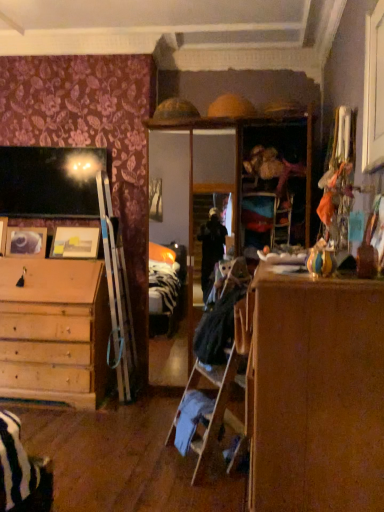
What do you see at coordinates (75, 242) in the screenshot? I see `matte wooden picture frame at left, the 2th picture frame when ordered from left to right` at bounding box center [75, 242].

Measure the distance between point (36,252) and camera.

The distance of point (36,252) from camera is 12.18 feet.

Locate an element on the screen. The image size is (384, 512). brown wood dresser at center is located at coordinates (317, 394).

Locate an element on the screen. The width and height of the screenshot is (384, 512). matte wooden picture frame at left, which appears as the 1th picture frame when viewed from the right is located at coordinates coord(75,242).

Choose the correct answer: Is matte wooden picture frame at left, the 2th picture frame when ordered from left to right, inside wooden photo frame at left, which appears as the 1th picture frame when viewed from the left, or outside it?

The correct answer is: outside.

Measure the distance from matte wooden picture frame at left, which appears as the 1th picture frame when viewed from the right, to wooden photo frame at left, marked as the second picture frame in a right-to-left arrangement.

They are 10.04 inches apart.

Between matte wooden picture frame at left, the 2th picture frame when ordered from left to right, and wooden photo frame at left, marked as the second picture frame in a right-to-left arrangement, which one appears on the left side from the viewer's perspective?

From the viewer's perspective, wooden photo frame at left, marked as the second picture frame in a right-to-left arrangement, appears more on the left side.

Is the depth of matte wooden picture frame at left, the 2th picture frame when ordered from left to right, less than that of wooden photo frame at left, marked as the second picture frame in a right-to-left arrangement?

Yes.

Does black fabric laundry at center turn towards wooden photo frame at left, marked as the second picture frame in a right-to-left arrangement?

No, black fabric laundry at center is not oriented towards wooden photo frame at left, marked as the second picture frame in a right-to-left arrangement.

From their relative heights in the image, would you say black fabric laundry at center is taller or shorter than wooden photo frame at left, which appears as the 1th picture frame when viewed from the left?

Clearly, black fabric laundry at center is taller compared to wooden photo frame at left, which appears as the 1th picture frame when viewed from the left.

From the picture: From the image's perspective, is black fabric laundry at center located above wooden photo frame at left, which appears as the 1th picture frame when viewed from the left?

Actually, black fabric laundry at center appears below wooden photo frame at left, which appears as the 1th picture frame when viewed from the left, in the image.

From a real-world perspective, which is physically above, black fabric laundry at center or wooden photo frame at left, which appears as the 1th picture frame when viewed from the left?

wooden photo frame at left, which appears as the 1th picture frame when viewed from the left, is physically above.

Considering the positions of objects brown wood dresser at center and matte wooden picture frame at left, the 2th picture frame when ordered from left to right, in the image provided, who is behind, brown wood dresser at center or matte wooden picture frame at left, the 2th picture frame when ordered from left to right,?

Positioned behind is matte wooden picture frame at left, the 2th picture frame when ordered from left to right.

Which of these two, brown wood dresser at center or matte wooden picture frame at left, the 2th picture frame when ordered from left to right, is smaller?

Smaller between the two is matte wooden picture frame at left, the 2th picture frame when ordered from left to right.

In the scene shown: From a real-world perspective, does brown wood dresser at center stand above matte wooden picture frame at left, which appears as the 1th picture frame when viewed from the right?

Actually, brown wood dresser at center is physically below matte wooden picture frame at left, which appears as the 1th picture frame when viewed from the right, in the real world.

From the image's perspective, which is above, brown wood dresser at center or matte wooden picture frame at left, the 2th picture frame when ordered from left to right?

matte wooden picture frame at left, the 2th picture frame when ordered from left to right, from the image's perspective.

From the image's perspective, which object appears higher, wooden photo frame at left, which appears as the 1th picture frame when viewed from the left, or brown wood dresser at center?

wooden photo frame at left, which appears as the 1th picture frame when viewed from the left, from the image's perspective.

Consider the image. Does wooden photo frame at left, marked as the second picture frame in a right-to-left arrangement, have a lesser height compared to brown wood dresser at center?

Correct, wooden photo frame at left, marked as the second picture frame in a right-to-left arrangement, is not as tall as brown wood dresser at center.

Does point (16, 233) appear closer or farther from the camera than point (348, 436)?

Point (16, 233) appears to be farther away from the viewer than point (348, 436).

Based on their sizes in the image, would you say brown wood dresser at center is bigger or smaller than wooden photo frame at left, which appears as the 1th picture frame when viewed from the left?

Clearly, brown wood dresser at center is larger in size than wooden photo frame at left, which appears as the 1th picture frame when viewed from the left.

From the image's perspective, who appears lower, brown wood dresser at center or wooden photo frame at left, marked as the second picture frame in a right-to-left arrangement?

brown wood dresser at center appears lower in the image.

Is brown wood dresser at center not within wooden photo frame at left, marked as the second picture frame in a right-to-left arrangement?

Absolutely, brown wood dresser at center is external to wooden photo frame at left, marked as the second picture frame in a right-to-left arrangement.

Is the position of matte wooden picture frame at left, which appears as the 1th picture frame when viewed from the right, more distant than that of brown wood dresser at center?

Yes, it is.

Is matte wooden picture frame at left, which appears as the 1th picture frame when viewed from the right, shorter than brown wood dresser at center?

Correct, matte wooden picture frame at left, which appears as the 1th picture frame when viewed from the right, is not as tall as brown wood dresser at center.

From the image's perspective, is matte wooden picture frame at left, which appears as the 1th picture frame when viewed from the right, located above or below brown wood dresser at center?

matte wooden picture frame at left, which appears as the 1th picture frame when viewed from the right, is situated higher than brown wood dresser at center in the image.

Is black fabric laundry at center in front of brown wood dresser at center?

No.

Measure the distance between black fabric laundry at center and brown wood dresser at center.

The distance of black fabric laundry at center from brown wood dresser at center is 4.25 feet.

Can we say black fabric laundry at center lies outside brown wood dresser at center?

Yes.

You are a GUI agent. You are given a task and a screenshot of the screen. Output one action in this format:
    pyautogui.click(x=<x>, y=<y>)
    Task: Click on the cabinetry that appears below the black fabric laundry at center (from a real-world perspective)
    The image size is (384, 512).
    Given the screenshot: What is the action you would take?
    pyautogui.click(x=317, y=394)

Identify the location of picture frame behind the matte wooden picture frame at left, which appears as the 1th picture frame when viewed from the right. This screenshot has width=384, height=512. (26, 242).

Where is `the 1st picture frame positioned above the black fabric laundry at center (from a real-world perspective)`? The image size is (384, 512). the 1st picture frame positioned above the black fabric laundry at center (from a real-world perspective) is located at coordinates (26, 242).

Estimate the real-world distances between objects in this image. Which object is closer to matte wooden picture frame at left, the 2th picture frame when ordered from left to right, wooden photo frame at left, which appears as the 1th picture frame when viewed from the left, or brown wood dresser at center?

wooden photo frame at left, which appears as the 1th picture frame when viewed from the left, lies closer to matte wooden picture frame at left, the 2th picture frame when ordered from left to right, than the other object.

Considering their positions, is wooden photo frame at left, which appears as the 1th picture frame when viewed from the left, positioned further to brown wood dresser at center than matte wooden picture frame at left, which appears as the 1th picture frame when viewed from the right?

wooden photo frame at left, which appears as the 1th picture frame when viewed from the left.

Estimate the real-world distances between objects in this image. Which object is further from wooden photo frame at left, which appears as the 1th picture frame when viewed from the left, brown wood dresser at center or matte wooden picture frame at left, which appears as the 1th picture frame when viewed from the right?

brown wood dresser at center is further to wooden photo frame at left, which appears as the 1th picture frame when viewed from the left.

Based on the photo, from the image, which object appears to be farther from matte wooden picture frame at left, which appears as the 1th picture frame when viewed from the right, black fabric laundry at center or wooden photo frame at left, marked as the second picture frame in a right-to-left arrangement?

Among the two, black fabric laundry at center is located further to matte wooden picture frame at left, which appears as the 1th picture frame when viewed from the right.

Which object lies further to the anchor point brown wood dresser at center, black fabric laundry at center or wooden photo frame at left, which appears as the 1th picture frame when viewed from the left?

wooden photo frame at left, which appears as the 1th picture frame when viewed from the left.

Looking at the image, which one is located closer to wooden photo frame at left, marked as the second picture frame in a right-to-left arrangement, matte wooden picture frame at left, which appears as the 1th picture frame when viewed from the right, or brown wood dresser at center?

The object closer to wooden photo frame at left, marked as the second picture frame in a right-to-left arrangement, is matte wooden picture frame at left, which appears as the 1th picture frame when viewed from the right.

Which object lies nearer to the anchor point black fabric laundry at center, matte wooden picture frame at left, the 2th picture frame when ordered from left to right, or wooden photo frame at left, which appears as the 1th picture frame when viewed from the left?

matte wooden picture frame at left, the 2th picture frame when ordered from left to right.

Considering their positions, is black fabric laundry at center positioned further to brown wood dresser at center than matte wooden picture frame at left, the 2th picture frame when ordered from left to right?

matte wooden picture frame at left, the 2th picture frame when ordered from left to right.

This screenshot has width=384, height=512. In order to click on picture frame between brown wood dresser at center and wooden photo frame at left, marked as the second picture frame in a right-to-left arrangement, in the front-back direction in this screenshot , I will do `click(75, 242)`.

I want to click on picture frame between wooden photo frame at left, marked as the second picture frame in a right-to-left arrangement, and black fabric laundry at center from left to right, so click(75, 242).

The width and height of the screenshot is (384, 512). What are the coordinates of `laundry positioned between brown wood dresser at center and matte wooden picture frame at left, which appears as the 1th picture frame when viewed from the right, from near to far` in the screenshot? It's located at (221, 318).

The image size is (384, 512). What are the coordinates of `laundry between brown wood dresser at center and wooden photo frame at left, marked as the second picture frame in a right-to-left arrangement, along the z-axis` in the screenshot? It's located at pos(221,318).